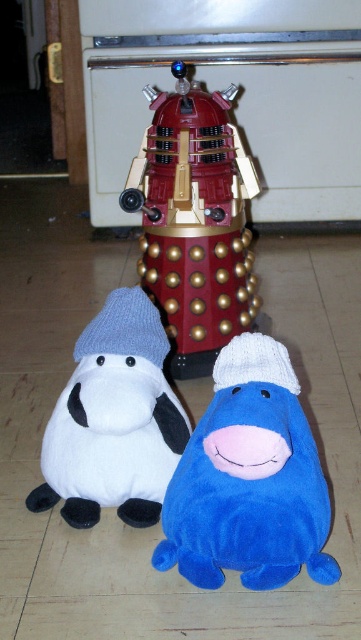
You are organizing a toy shelf in a child room. You have two items to place on the shelf. The white plush sheep at lower left and the gray knitted hat at center. Which item requires more space on the shelf?

The white plush sheep at lower left requires more space on the shelf because it is bigger than the gray knitted hat at center.

You are standing in the kitchen and see the metallic gold dalek at center and the gray knitted hat at center. Which object is positioned to the right of the other?

The metallic gold dalek at center is positioned to the right of the gray knitted hat at center.

Consider the image. You are a person standing at the entrance of the kitchen. You see the velvety blue plush at lower center and the metallic gold dalek at center. Which object is closer to the floor?

The velvety blue plush at lower center is located below the metallic gold dalek at center, so it is closer to the floor.